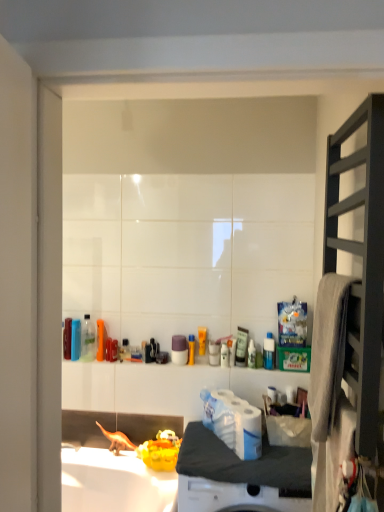
Question: Is white glossy toilet paper at center aimed at white matte counter top at center?

Choices:
 (A) yes
 (B) no

Answer: (B)

Question: Is there a large distance between white glossy toilet paper at center and white matte counter top at center?

Choices:
 (A) yes
 (B) no

Answer: (B)

Question: Is white glossy toilet paper at center not within white matte counter top at center?

Choices:
 (A) yes
 (B) no

Answer: (A)

Question: From a real-world perspective, does white glossy toilet paper at center stand above white matte counter top at center?

Choices:
 (A) yes
 (B) no

Answer: (A)

Question: Is white glossy toilet paper at center looking in the opposite direction of white matte counter top at center?

Choices:
 (A) yes
 (B) no

Answer: (B)

Question: Does point (236, 401) appear closer or farther from the camera than point (218, 465)?

Choices:
 (A) farther
 (B) closer

Answer: (A)

Question: From the image's perspective, relative to white matte counter top at center, is white glossy toilet paper at center above or below?

Choices:
 (A) above
 (B) below

Answer: (A)

Question: In terms of width, does white glossy toilet paper at center look wider or thinner when compared to white matte counter top at center?

Choices:
 (A) wide
 (B) thin

Answer: (B)

Question: Considering their positions, is white glossy toilet paper at center located in front of or behind white matte counter top at center?

Choices:
 (A) front
 (B) behind

Answer: (B)

Question: Considering the relative positions of dark wood shelf at right and white glossy toilet paper at center in the image provided, is dark wood shelf at right to the left or to the right of white glossy toilet paper at center?

Choices:
 (A) left
 (B) right

Answer: (B)

Question: Is dark wood shelf at right in front of or behind white glossy toilet paper at center in the image?

Choices:
 (A) behind
 (B) front

Answer: (B)

Question: Is point (370, 144) closer or farther from the camera than point (223, 395)?

Choices:
 (A) farther
 (B) closer

Answer: (B)

Question: Is dark wood shelf at right taller or shorter than white glossy toilet paper at center?

Choices:
 (A) short
 (B) tall

Answer: (B)

Question: Looking at their shapes, would you say white matte counter top at center is wider or thinner than white glossy toilet paper at center?

Choices:
 (A) thin
 (B) wide

Answer: (B)

Question: Is white matte counter top at center spatially inside white glossy toilet paper at center, or outside of it?

Choices:
 (A) inside
 (B) outside

Answer: (B)